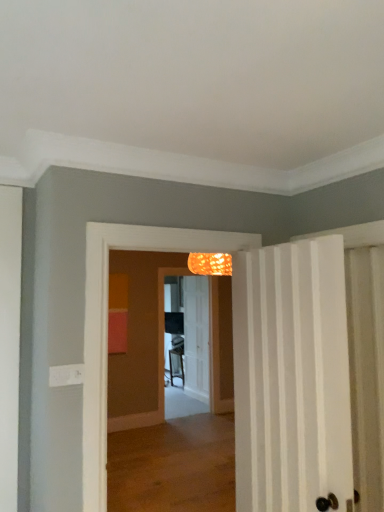
Question: From the image's perspective, is white striped door at right, the 2th door in the back-to-front sequence, located above white textured door at center, which is counted as the second door, starting from the front?

Choices:
 (A) no
 (B) yes

Answer: (B)

Question: Is white striped door at right, the 1th door positioned from the front, aimed at white textured door at center, the first door in the back-to-front sequence?

Choices:
 (A) no
 (B) yes

Answer: (A)

Question: From a real-world perspective, is white striped door at right, the 2th door in the back-to-front sequence, physically above white textured door at center, which is counted as the second door, starting from the front?

Choices:
 (A) no
 (B) yes

Answer: (B)

Question: Can you confirm if white striped door at right, the 1th door positioned from the front, is smaller than white textured door at center, which is counted as the second door, starting from the front?

Choices:
 (A) yes
 (B) no

Answer: (B)

Question: Is white textured door at center, the first door in the back-to-front sequence, a part of white striped door at right, the 2th door in the back-to-front sequence?

Choices:
 (A) yes
 (B) no

Answer: (B)

Question: Is white striped door at right, the 2th door in the back-to-front sequence, spatially inside translucent glass screen door at center, or outside of it?

Choices:
 (A) outside
 (B) inside

Answer: (A)

Question: Is white striped door at right, the 1th door positioned from the front, wider or thinner than translucent glass screen door at center?

Choices:
 (A) thin
 (B) wide

Answer: (B)

Question: Considering their positions, is white striped door at right, the 1th door positioned from the front, located in front of or behind translucent glass screen door at center?

Choices:
 (A) behind
 (B) front

Answer: (B)

Question: Based on their positions, is white striped door at right, the 2th door in the back-to-front sequence, located to the left or right of translucent glass screen door at center?

Choices:
 (A) left
 (B) right

Answer: (B)

Question: From the image's perspective, relative to translucent glass screen door at center, is white textured door at center, the first door in the back-to-front sequence, above or below?

Choices:
 (A) below
 (B) above

Answer: (A)

Question: Based on their positions, is white textured door at center, the first door in the back-to-front sequence, located to the left or right of translucent glass screen door at center?

Choices:
 (A) right
 (B) left

Answer: (A)

Question: From their relative heights in the image, would you say white textured door at center, the first door in the back-to-front sequence, is taller or shorter than translucent glass screen door at center?

Choices:
 (A) tall
 (B) short

Answer: (B)

Question: Is white textured door at center, the first door in the back-to-front sequence, wider or thinner than translucent glass screen door at center?

Choices:
 (A) wide
 (B) thin

Answer: (B)

Question: Considering the positions of translucent glass screen door at center and white striped door at right, the 2th door in the back-to-front sequence, in the image, is translucent glass screen door at center wider or thinner than white striped door at right, the 2th door in the back-to-front sequence,?

Choices:
 (A) wide
 (B) thin

Answer: (B)

Question: From a real-world perspective, is translucent glass screen door at center physically located above or below white striped door at right, the 2th door in the back-to-front sequence?

Choices:
 (A) below
 (B) above

Answer: (A)